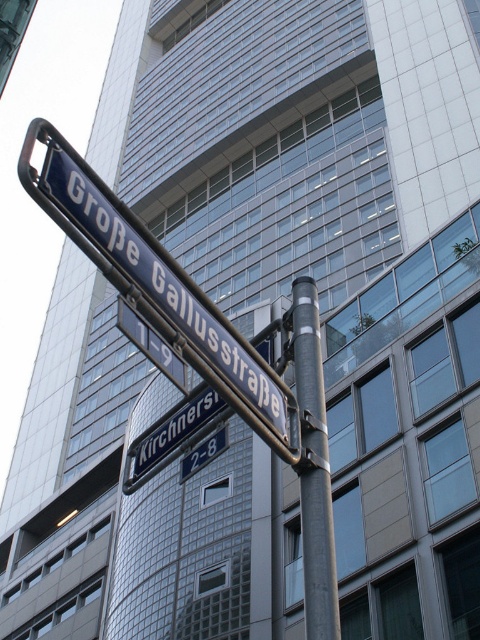
Question: Is metallic blue street sign at center positioned in front of metallic gray pole at center?

Choices:
 (A) no
 (B) yes

Answer: (B)

Question: Among these points, which one is farthest from the camera?

Choices:
 (A) (326, 435)
 (B) (86, 232)

Answer: (A)

Question: Which point is closer to the camera taking this photo?

Choices:
 (A) (119, 285)
 (B) (300, 397)

Answer: (A)

Question: Can you confirm if metallic blue street sign at center is positioned to the left of metallic gray pole at center?

Choices:
 (A) no
 (B) yes

Answer: (B)

Question: Is metallic blue street sign at center to the right of metallic gray pole at center from the viewer's perspective?

Choices:
 (A) no
 (B) yes

Answer: (A)